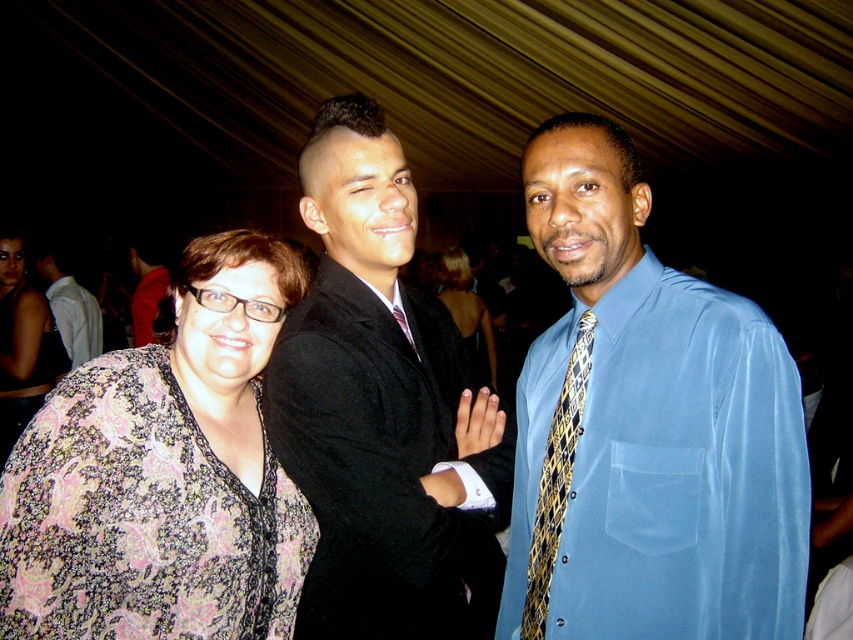
Does paisley-patterned blouse at center-left have a greater width compared to floral-patterned blouse at center-left?

Indeed, paisley-patterned blouse at center-left has a greater width compared to floral-patterned blouse at center-left.

Between point (15, 451) and point (22, 289), which one is positioned behind?

Point (22, 289)

The width and height of the screenshot is (853, 640). Identify the location of paisley-patterned blouse at center-left. (163, 474).

Who is positioned more to the right, blue satin shirt at center or matte black suit at center?

blue satin shirt at center is more to the right.

Who is taller, blue satin shirt at center or matte black suit at center?

blue satin shirt at center

Is point (637, 484) behind point (149, 291)?

No, it is in front of (149, 291).

You are a GUI agent. You are given a task and a screenshot of the screen. Output one action in this format:
    pyautogui.click(x=<x>, y=<y>)
    Task: Click on the blue satin shirt at center
    This screenshot has height=640, width=853.
    Given the screenshot: What is the action you would take?
    pyautogui.click(x=646, y=428)

Who is positioned more to the right, gold and navy patterned tie at right or matte black suit at center?

gold and navy patterned tie at right is more to the right.

Is gold and navy patterned tie at right bigger than matte black suit at center?

No, gold and navy patterned tie at right is not bigger than matte black suit at center.

What are the coordinates of `gold and navy patterned tie at right` in the screenshot? It's located at (556, 481).

I want to click on gold and navy patterned tie at right, so click(x=556, y=481).